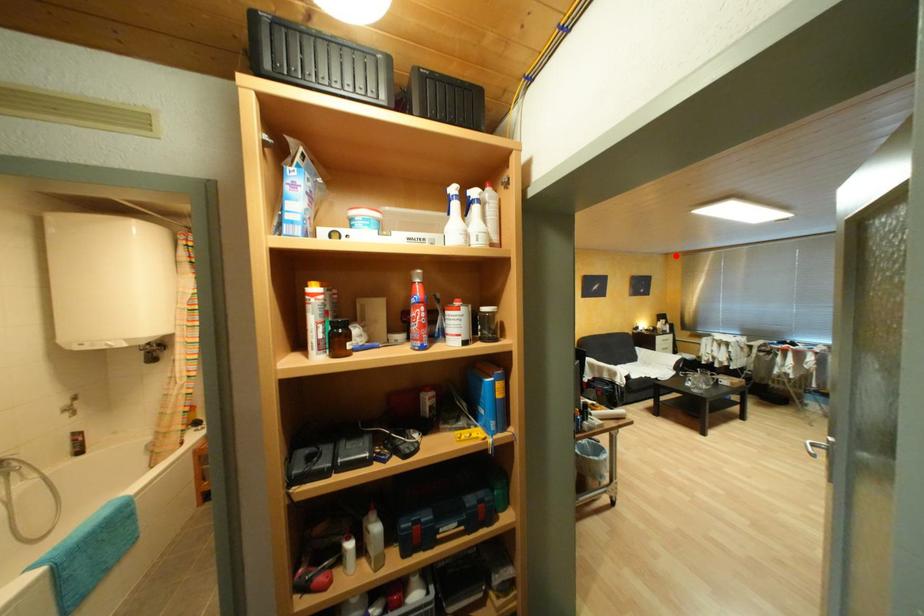
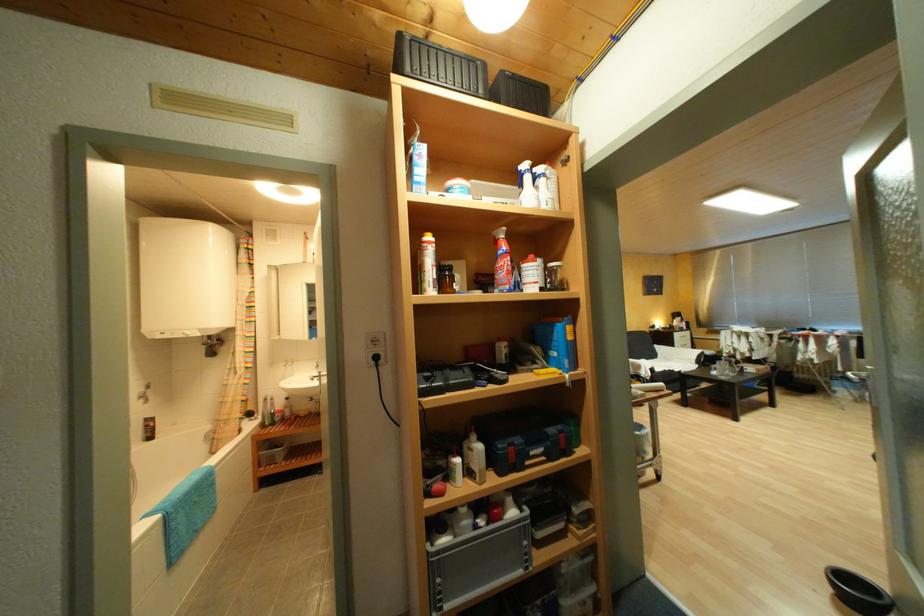
In the second image, find the point that corresponds to the highlighted location in the first image.

(685, 256)